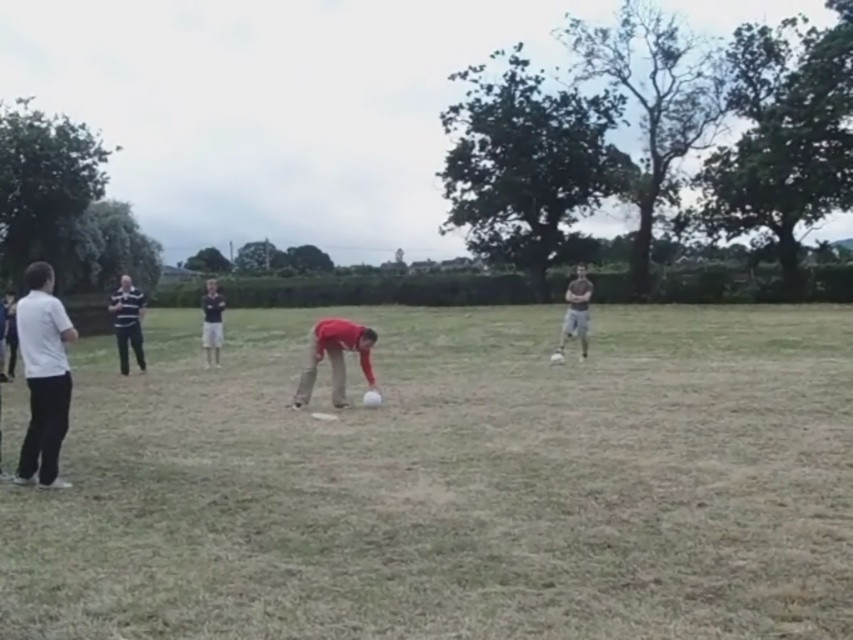
Does striped cotton shirt at left appear on the right side of striped polo shirt at center?

No, striped cotton shirt at left is not to the right of striped polo shirt at center.

Does point (111, 307) come farther from viewer compared to point (206, 285)?

That is False.

Identify the location of striped cotton shirt at left. (126, 323).

Does striped cotton shirt at left appear on the left side of matte gray shirt at center?

Yes, striped cotton shirt at left is to the left of matte gray shirt at center.

Does point (143, 300) come in front of point (578, 326)?

Yes, it is in front of point (578, 326).

What are the coordinates of `striped cotton shirt at left` in the screenshot? It's located at (126, 323).

Locate an element on the screen. This screenshot has height=640, width=853. striped cotton shirt at left is located at coordinates (126, 323).

Does point (363, 339) lie behind point (131, 340)?

No, (363, 339) is closer to viewer.

Is matte red shirt at center wider than striped cotton shirt at left?

In fact, matte red shirt at center might be narrower than striped cotton shirt at left.

Between point (334, 396) and point (126, 364), which one is positioned behind?

Point (126, 364)

Identify the location of matte red shirt at center. Image resolution: width=853 pixels, height=640 pixels. (334, 356).